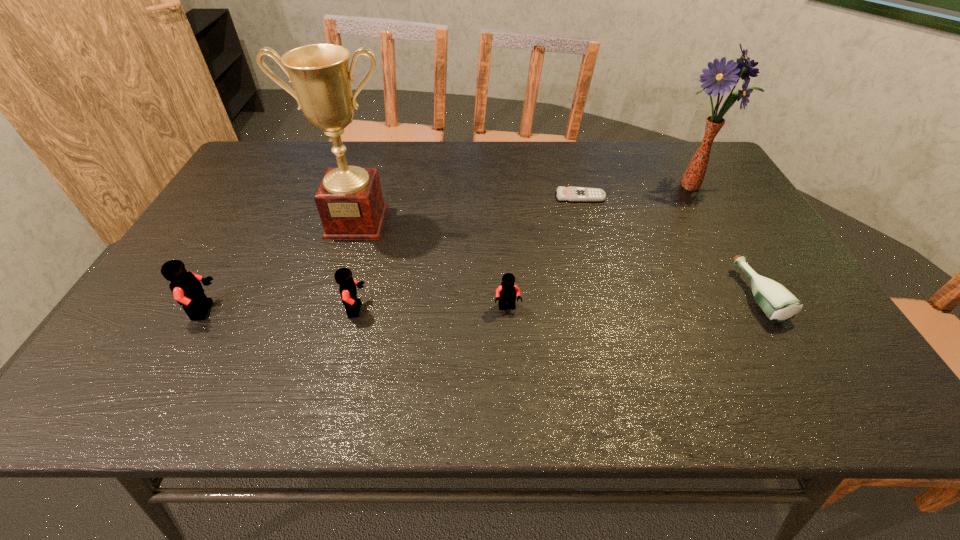
Find the location of a particular element. The image size is (960, 540). free space for a new Lego on the right is located at coordinates (658, 306).